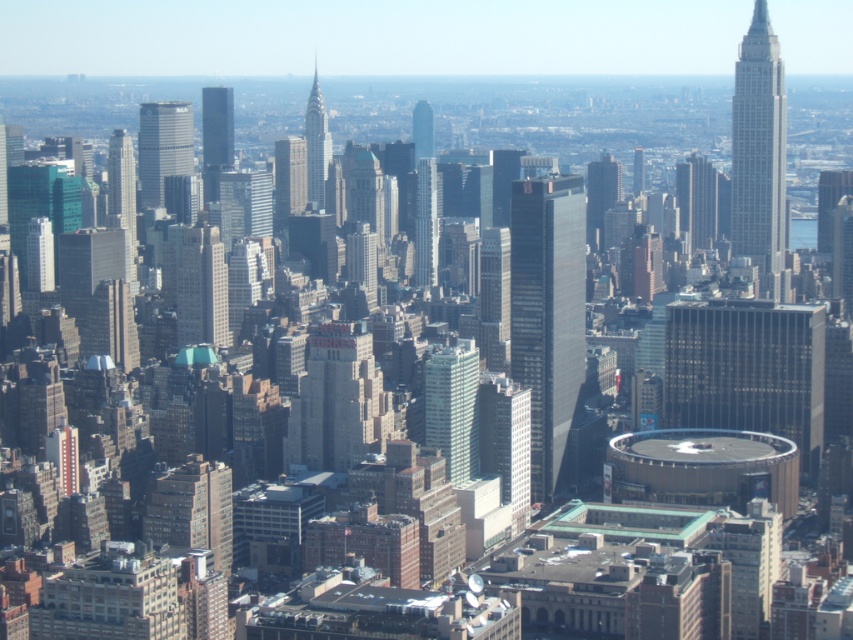
Which of these two, white marble skyscraper at upper right or matte glass skyscraper at center, stands taller?

With more height is white marble skyscraper at upper right.

Consider the image. Is white marble skyscraper at upper right thinner than matte glass skyscraper at center?

No, white marble skyscraper at upper right is not thinner than matte glass skyscraper at center.

Between point (776, 156) and point (222, 305), which one is positioned behind?

Point (776, 156)

Where is `white marble skyscraper at upper right`? This screenshot has width=853, height=640. white marble skyscraper at upper right is located at coordinates (759, 154).

Is dark gray glass skyscraper at center wider than silver glass skyscraper at center-left?

Indeed, dark gray glass skyscraper at center has a greater width compared to silver glass skyscraper at center-left.

Does point (511, 269) come in front of point (138, 104)?

Yes.

Image resolution: width=853 pixels, height=640 pixels. I want to click on dark gray glass skyscraper at center, so click(547, 314).

This screenshot has height=640, width=853. What are the coordinates of `matte glass skyscraper at center-left` in the screenshot? It's located at (216, 138).

Between matte glass skyscraper at center-left and shiny silver spire at center, which one is positioned lower?

matte glass skyscraper at center-left

Identify the location of matte glass skyscraper at center-left. (216, 138).